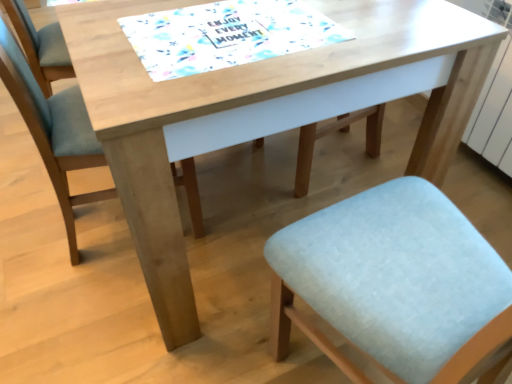
Question: Is white paper placemat at center not inside light blue fabric chair at lower left?

Choices:
 (A) no
 (B) yes

Answer: (B)

Question: Considering the relative sizes of white paper placemat at center and light blue fabric chair at lower left in the image provided, is white paper placemat at center smaller than light blue fabric chair at lower left?

Choices:
 (A) no
 (B) yes

Answer: (B)

Question: Is white paper placemat at center taller than light blue fabric chair at lower left?

Choices:
 (A) no
 (B) yes

Answer: (A)

Question: Is white paper placemat at center facing away from light blue fabric chair at lower left?

Choices:
 (A) yes
 (B) no

Answer: (B)

Question: Considering the relative positions of white paper placemat at center and light blue fabric chair at lower left in the image provided, is white paper placemat at center to the left of light blue fabric chair at lower left from the viewer's perspective?

Choices:
 (A) yes
 (B) no

Answer: (B)

Question: Is white paper placemat at center directly adjacent to light blue fabric chair at lower left?

Choices:
 (A) yes
 (B) no

Answer: (B)

Question: Considering the relative sizes of light blue fabric chair at lower left and white paper placemat at center in the image provided, is light blue fabric chair at lower left thinner than white paper placemat at center?

Choices:
 (A) yes
 (B) no

Answer: (B)

Question: Can you confirm if light blue fabric chair at lower left is positioned to the left of white paper placemat at center?

Choices:
 (A) yes
 (B) no

Answer: (A)

Question: Is white paper placemat at center at the back of light blue fabric chair at lower left?

Choices:
 (A) no
 (B) yes

Answer: (A)

Question: Is light blue fabric chair at lower left completely or partially outside of white paper placemat at center?

Choices:
 (A) no
 (B) yes

Answer: (B)

Question: Does light blue fabric chair at lower left have a greater width compared to white paper placemat at center?

Choices:
 (A) no
 (B) yes

Answer: (B)

Question: Considering the relative sizes of light blue fabric chair at lower left and white paper placemat at center in the image provided, is light blue fabric chair at lower left taller than white paper placemat at center?

Choices:
 (A) no
 (B) yes

Answer: (B)

Question: Is white paper placemat at center in front of or behind light blue fabric chair at lower left in the image?

Choices:
 (A) behind
 (B) front

Answer: (B)